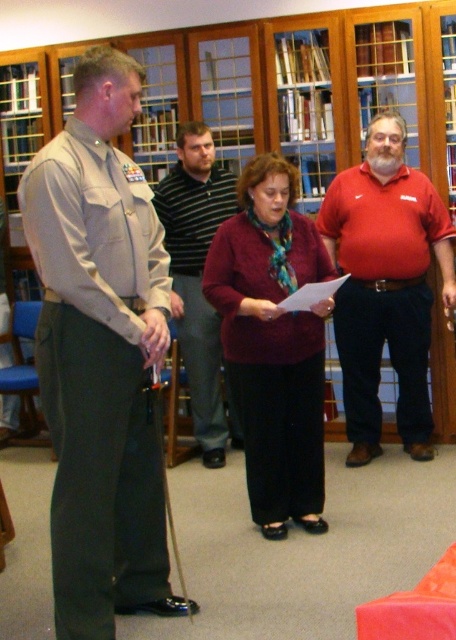
Which object is located at the coordinates point (100, 355)?

The point (100, 355) is located on the khaki uniform at left.

You are standing at the entrance of the library and see the khaki uniform at left and the striped cotton shirt at center. Which person is closer to you?

The khaki uniform at left is closer to the viewer than the striped cotton shirt at center, so the person in the khaki uniform at left is closer to you.

Based on the photo, you are an event planner arranging seating for a formal event. You need to seat the khaki uniform at left and the maroon sweater at center. Which of the two requires a wider seat? Please explain your reasoning based on their attire.

The maroon sweater at center requires a wider seat because the khaki uniform at left is thinner than the maroon sweater at center, implying that the maroon sweater at center is broader in width.